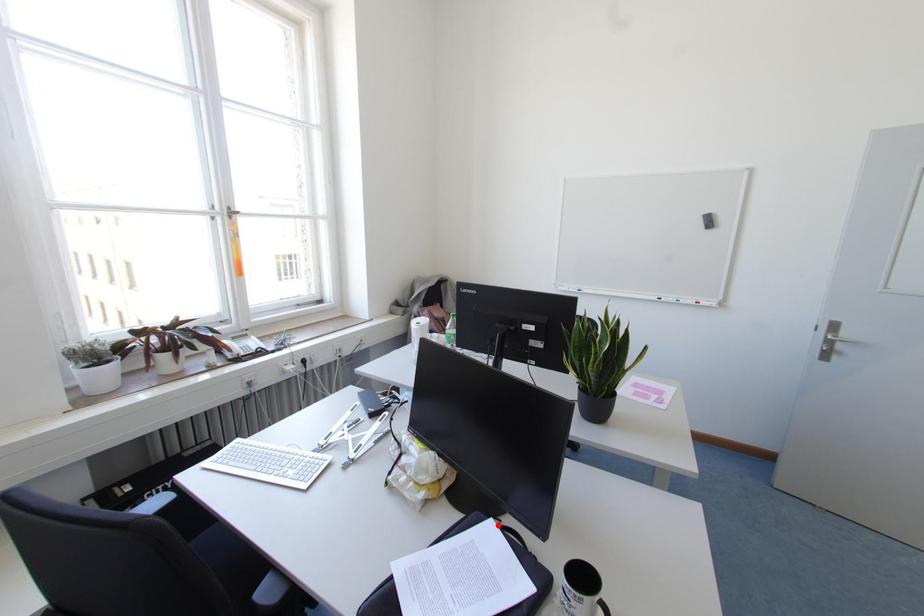
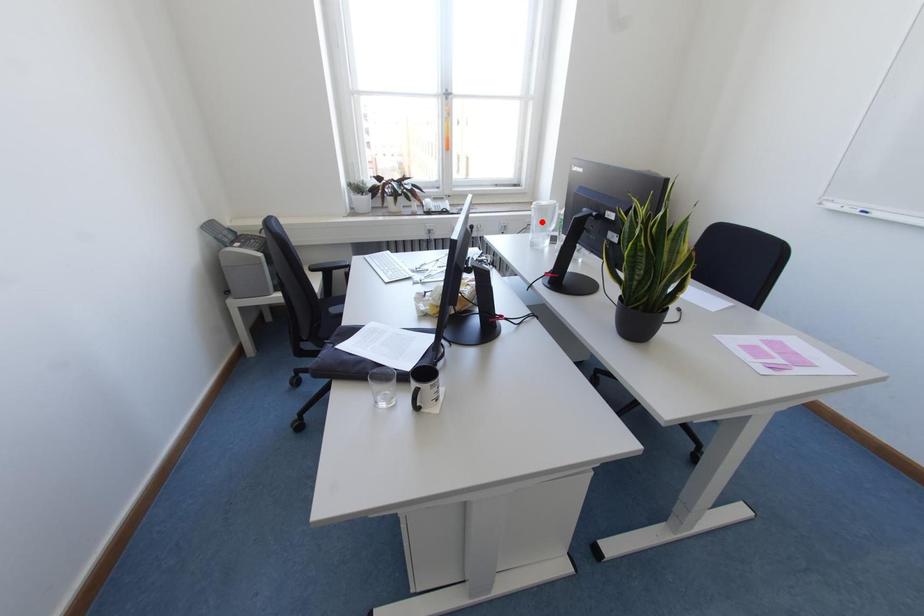
I am providing you with two images of the same scene from different viewpoints. A red point is marked on the first image and another point is marked on the second image. Does the point marked in image1 correspond to the same location as the one in image2?

No